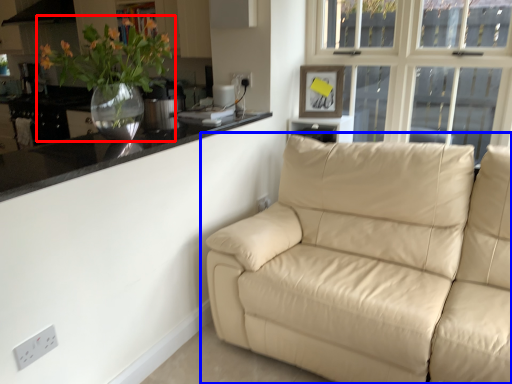
Question: Among these objects, which one is farthest to the camera, houseplant (highlighted by a red box) or studio couch (highlighted by a blue box)?

Choices:
 (A) houseplant
 (B) studio couch

Answer: (A)